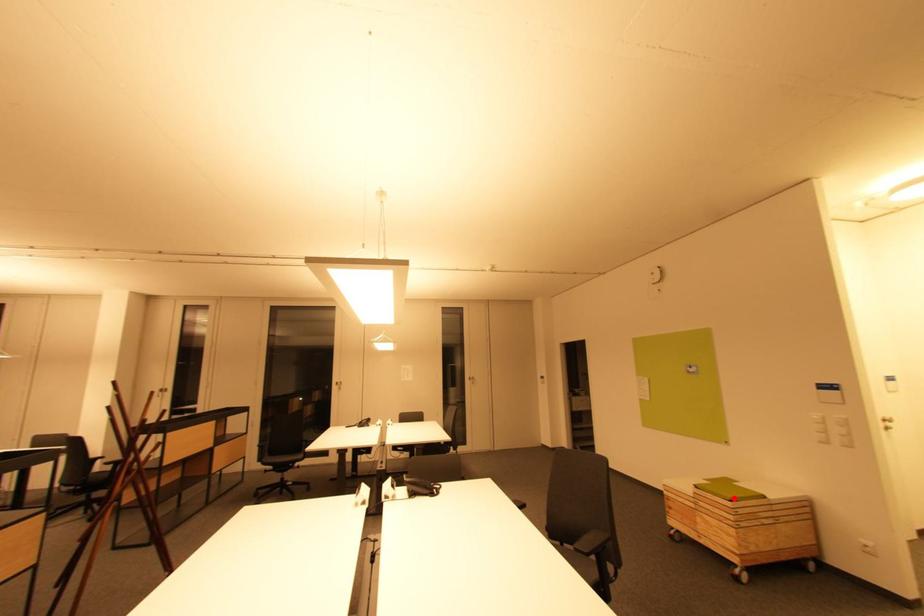
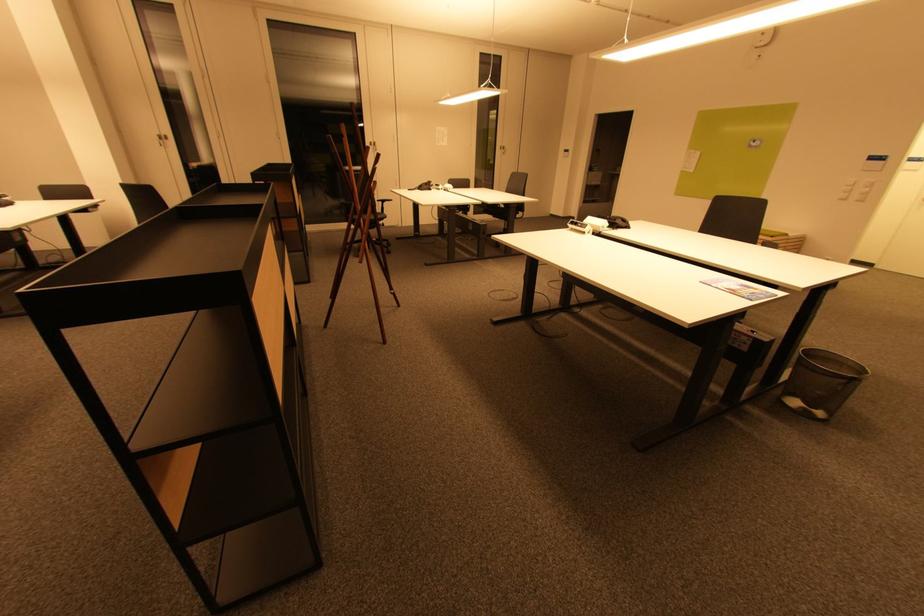
Question: I am providing you with two images of the same scene from different viewpoints. Image1 has a red point marked. In image2, the corresponding 3D location appears at what relative position? Reply with the corresponding letter.

Choices:
 (A) Closer
 (B) Farther

Answer: (B)